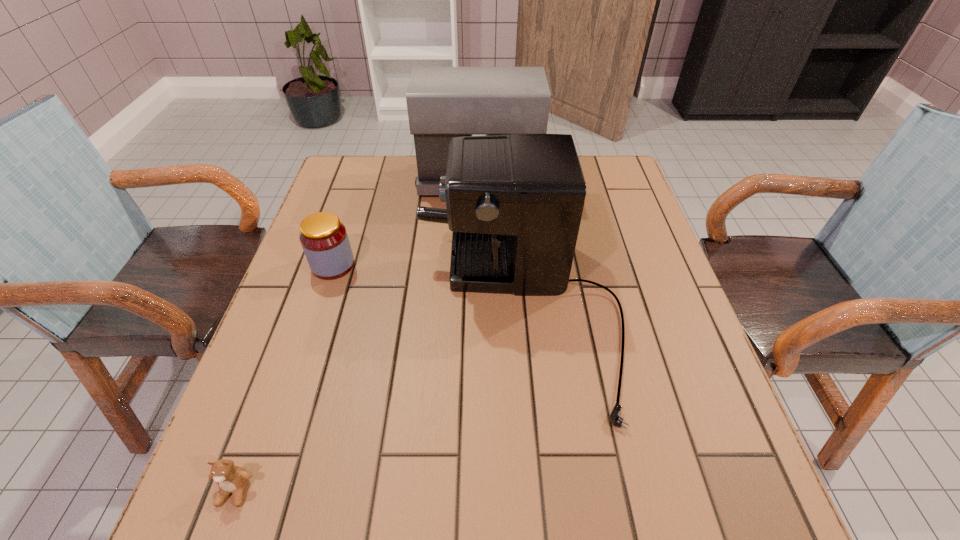
Where is `the farthest object`? the farthest object is located at coordinates (442, 102).

This screenshot has height=540, width=960. What are the coordinates of `the nearer coffee maker` in the screenshot? It's located at (514, 202).

Locate an element on the screen. This screenshot has width=960, height=540. jar is located at coordinates (324, 239).

The height and width of the screenshot is (540, 960). Identify the location of the nearest object. (231, 479).

Image resolution: width=960 pixels, height=540 pixels. I want to click on teddy bear, so click(231, 479).

Where is `vacant space located on the carafe side of the farthest object`? The width and height of the screenshot is (960, 540). vacant space located on the carafe side of the farthest object is located at coordinates (607, 180).

Where is `blank area located 0.080m on the front-facing side of the nearer coffee maker`? The height and width of the screenshot is (540, 960). blank area located 0.080m on the front-facing side of the nearer coffee maker is located at coordinates (378, 314).

You are a GUI agent. You are given a task and a screenshot of the screen. Output one action in this format:
    pyautogui.click(x=<x>, y=<y>)
    Task: Click on the vacant space situated 0.230m on the front-facing side of the nearer coffee maker
    The width and height of the screenshot is (960, 540).
    Given the screenshot: What is the action you would take?
    pyautogui.click(x=310, y=314)

Locate an element on the screen. free spot located on the front-facing side of the nearer coffee maker is located at coordinates (319, 314).

In order to click on free space located on the back of the second shortest object in this screenshot , I will do `click(355, 199)`.